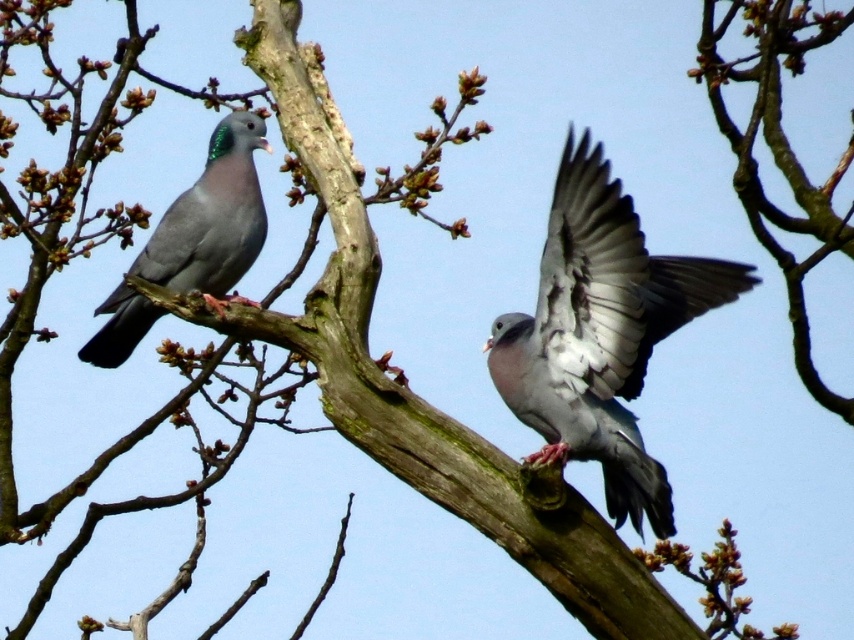
Between gray matte pigeon at center and matte gray pigeon at left, which one has less height?

matte gray pigeon at left is shorter.

The width and height of the screenshot is (854, 640). What do you see at coordinates (600, 333) in the screenshot? I see `gray matte pigeon at center` at bounding box center [600, 333].

The image size is (854, 640). I want to click on gray matte pigeon at center, so click(x=600, y=333).